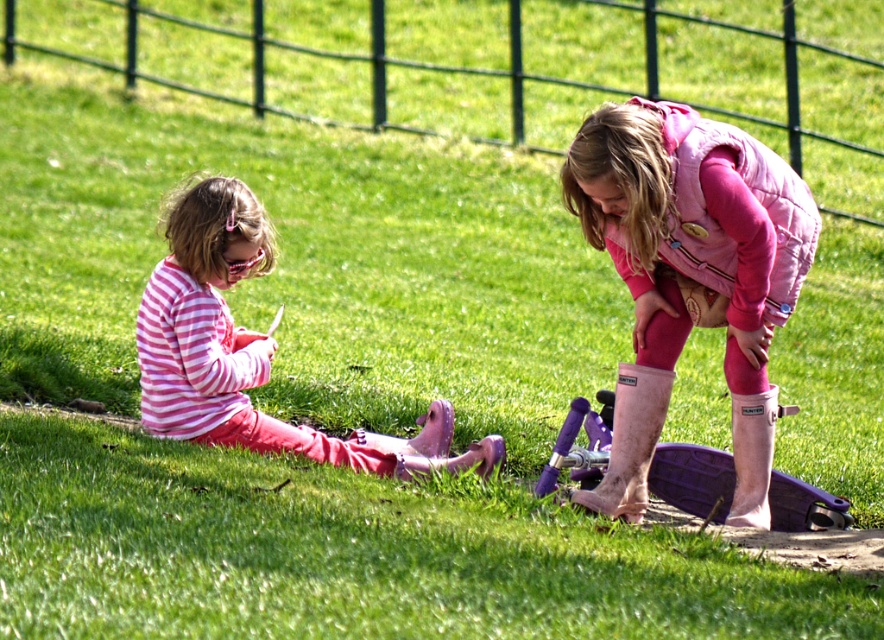
You are standing at the point labeled point (260,385) and want to walk to the point labeled point (725,308). Based on the scene description, which direction should you move to reach your destination?

You should move backward to reach point (725,308) because it is behind point (260,385).

You are a photographer trying to capture both the pink rubber boots at lower right and the pink striped shirt at left in a single frame. Since the camera can only focus on objects of a certain size, which object might need to be moved closer to ensure it is visible in the photo?

The pink rubber boots at lower right has a smaller size compared to the pink striped shirt at left, so the photographer should move the pink rubber boots at lower right closer to the camera to ensure it is visible in the photo.